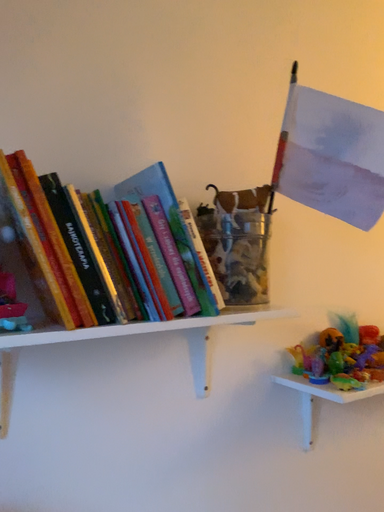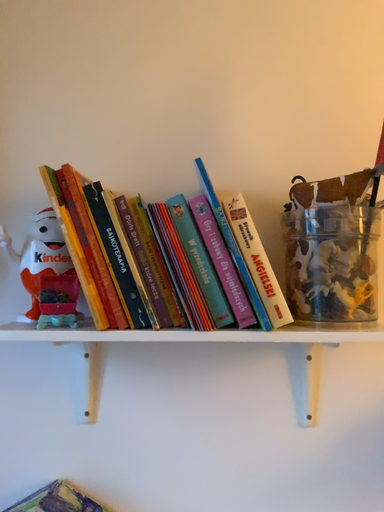
Question: Which way did the camera rotate in the video?

Choices:
 (A) rotated right
 (B) rotated left

Answer: (B)